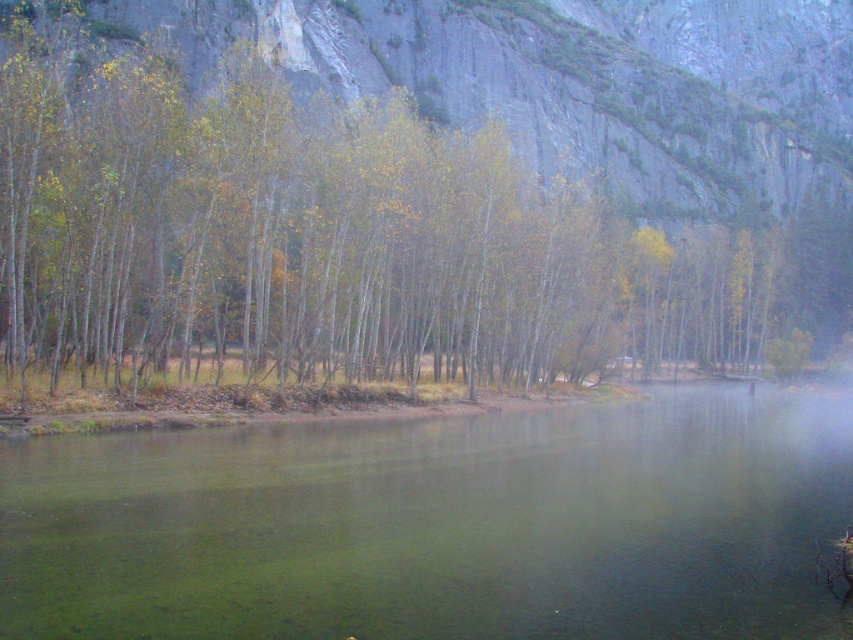
Looking at this image, you are a hiker standing at the edge of the water. You want to reach the cliff in the background. Which direction should you move relative to the green matte trees at center?

The green matte trees at center are located at point (415, 189). Since the cliff is in the background, you should move away from the green matte trees at center towards the back of the scene to reach the cliff.

You are planning to build a small wooden dock extending from the green matte trees at center towards the green translucent water at center. Considering their sizes, which object would require more space for construction?

The green matte trees at center has a larger size compared to green translucent water at center, so constructing a dock near the green matte trees at center would require more space due to their larger size.